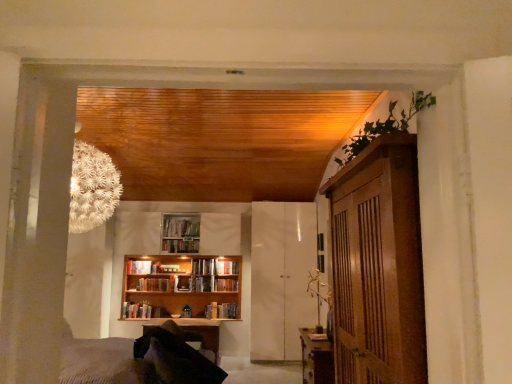
Question: Is wooden bookshelf at center, which ranks as the first book in bottom-to-top order, smaller than hardcover book at center, positioned as the third book in bottom-to-top order?

Choices:
 (A) yes
 (B) no

Answer: (B)

Question: Can you confirm if wooden bookshelf at center, which ranks as the first book in bottom-to-top order, is shorter than hardcover book at center, arranged as the fourth book when viewed from the top?

Choices:
 (A) yes
 (B) no

Answer: (B)

Question: Is wooden bookshelf at center, acting as the 6th book starting from the top, taller than hardcover book at center, positioned as the third book in bottom-to-top order?

Choices:
 (A) no
 (B) yes

Answer: (B)

Question: Is wooden bookshelf at center, acting as the 6th book starting from the top, bigger than hardcover book at center, arranged as the fourth book when viewed from the top?

Choices:
 (A) no
 (B) yes

Answer: (B)

Question: Is wooden bookshelf at center, acting as the 6th book starting from the top, not close to hardcover book at center, arranged as the fourth book when viewed from the top?

Choices:
 (A) yes
 (B) no

Answer: (B)

Question: Does wooden bookshelf at center, which ranks as the first book in bottom-to-top order, lie in front of hardcover book at center, arranged as the fourth book when viewed from the top?

Choices:
 (A) yes
 (B) no

Answer: (A)

Question: Is wooden bookshelf at center, which is the 1th book in top-to-bottom order, located outside hardcover book at center, the 4th book ordered from the bottom?

Choices:
 (A) yes
 (B) no

Answer: (A)

Question: Can you confirm if wooden bookshelf at center, which is the 1th book in top-to-bottom order, is thinner than hardcover book at center, the 4th book ordered from the bottom?

Choices:
 (A) yes
 (B) no

Answer: (A)

Question: From a real-world perspective, does wooden bookshelf at center, which is the sixth book from bottom to top, sit lower than hardcover book at center, which is the third book from top to bottom?

Choices:
 (A) yes
 (B) no

Answer: (B)

Question: Does wooden bookshelf at center, which is the sixth book from bottom to top, have a smaller size compared to hardcover book at center, which is the third book from top to bottom?

Choices:
 (A) no
 (B) yes

Answer: (B)

Question: Can you confirm if wooden bookshelf at center, which is the 1th book in top-to-bottom order, is positioned to the right of hardcover book at center, the 4th book ordered from the bottom?

Choices:
 (A) yes
 (B) no

Answer: (B)

Question: Does wooden bookshelf at center, which is the sixth book from bottom to top, have a larger size compared to hardcover book at center, which is the third book from top to bottom?

Choices:
 (A) yes
 (B) no

Answer: (B)

Question: Is wooden bookshelf at center, which is the 1th book in top-to-bottom order, to the left of wooden bookshelf at center, positioned as the second book in bottom-to-top order, from the viewer's perspective?

Choices:
 (A) no
 (B) yes

Answer: (A)